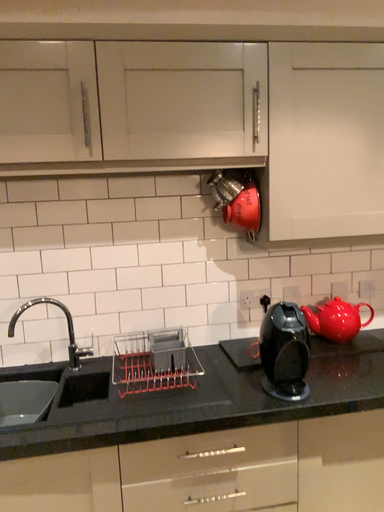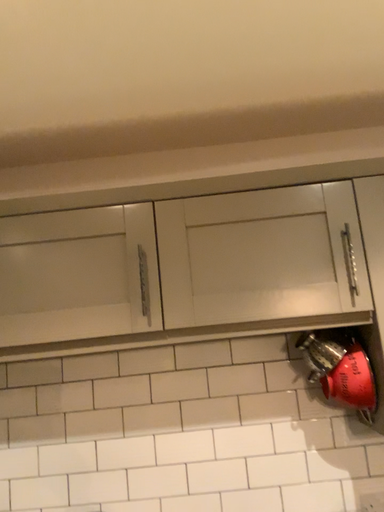
Question: Which way did the camera rotate in the video?

Choices:
 (A) rotated right
 (B) rotated left

Answer: (B)